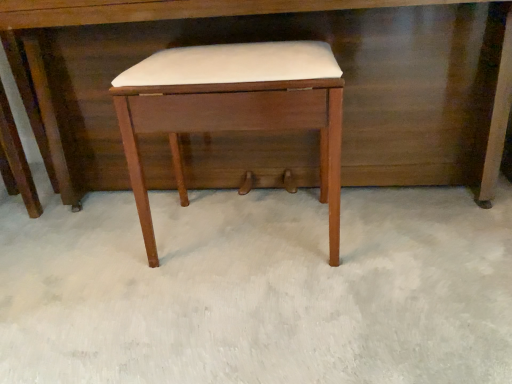
Question: In terms of height, does wooden desk at center look taller or shorter compared to white leather stool at center?

Choices:
 (A) short
 (B) tall

Answer: (B)

Question: From the image's perspective, relative to white leather stool at center, is wooden desk at center above or below?

Choices:
 (A) above
 (B) below

Answer: (A)

Question: Is wooden desk at center bigger or smaller than white leather stool at center?

Choices:
 (A) big
 (B) small

Answer: (A)

Question: Is white leather stool at center in front of or behind wooden desk at center in the image?

Choices:
 (A) behind
 (B) front

Answer: (B)

Question: Based on their sizes in the image, would you say white leather stool at center is bigger or smaller than wooden desk at center?

Choices:
 (A) big
 (B) small

Answer: (B)

Question: From their relative heights in the image, would you say white leather stool at center is taller or shorter than wooden desk at center?

Choices:
 (A) short
 (B) tall

Answer: (A)

Question: From a real-world perspective, is white leather stool at center physically located above or below wooden desk at center?

Choices:
 (A) below
 (B) above

Answer: (A)